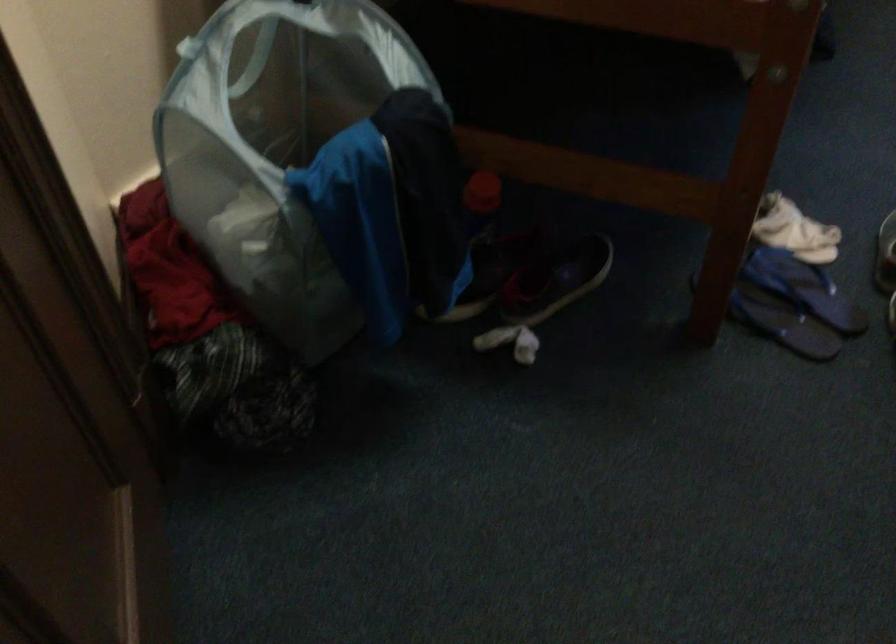
The location [556,279] corresponds to which object?

It refers to a dark sneaker.